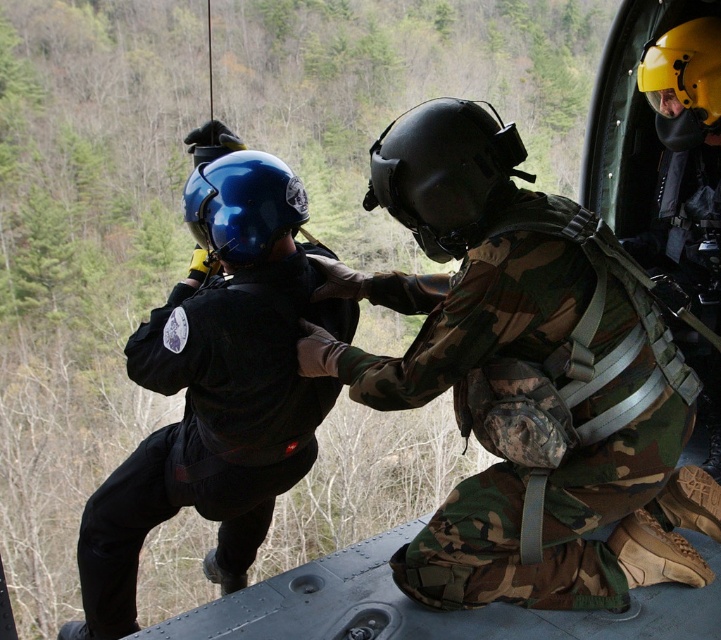
What object is located at the coordinates point (x=528, y=376) in the image?

The point (x=528, y=376) marks the camo fabric helmet at center.

You are a military medic assessing the equipment of two personnel preparing for a helicopter extraction. You notice the camo fabric helmet at center and the glossy blue helmet at center. Which helmet has a greater width?

The camo fabric helmet at center has a greater width than the glossy blue helmet at center.

You are a military medic assessing the situation. You see the matte black helmet at left and the yellow matte helmet at upper right. Which helmet is positioned higher in the image?

The matte black helmet at left is much taller than the yellow matte helmet at upper right, so the matte black helmet at left is positioned higher in the image.